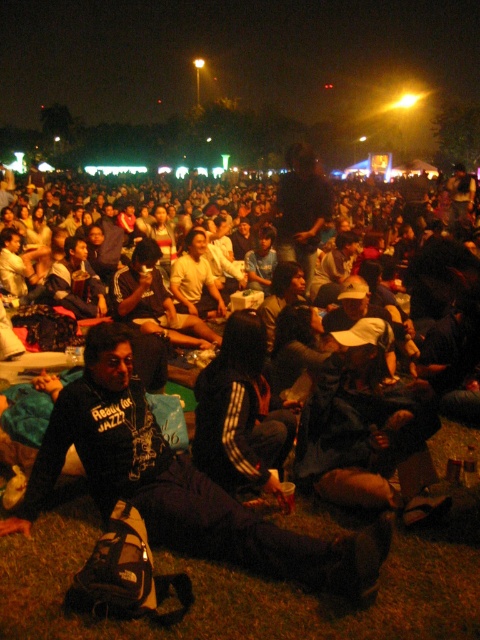
You are at the event and want to see the stage clearly. The black fleece jacket at center is blocking your view. Can you move around the black fabric crowd at lower left to get a better view?

The black fleece jacket at center is behind the black fabric crowd at lower left, so moving around the black fabric crowd at lower left might allow you to see past the black fleece jacket at center.